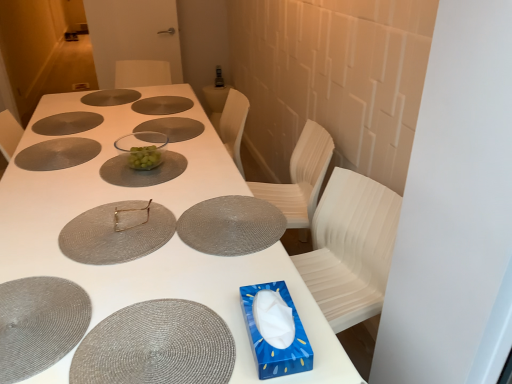
Where is `vacant space in between woven gray placemat at lower left and matte gray placemat at center, arranged as the second glass plate when viewed from the front`? vacant space in between woven gray placemat at lower left and matte gray placemat at center, arranged as the second glass plate when viewed from the front is located at coordinates (78, 258).